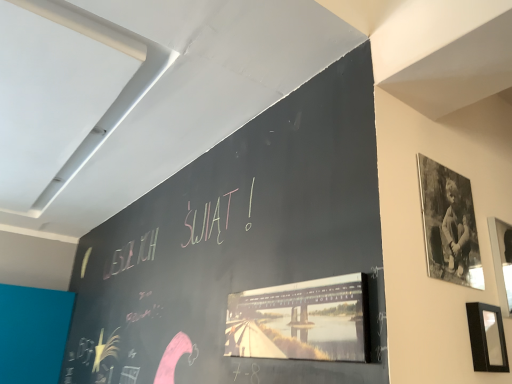
What is the approximate height of metallic photo frame at center?

8.23 inches.

Where is `metallic photo frame at center`? The height and width of the screenshot is (384, 512). metallic photo frame at center is located at coordinates (302, 320).

Measure the distance between metallic photo frame at center and camera.

metallic photo frame at center is 96.07 centimeters away from camera.

What do you see at coordinates (302, 320) in the screenshot? The width and height of the screenshot is (512, 384). I see `metallic photo frame at center` at bounding box center [302, 320].

Locate an element on the screen. Image resolution: width=512 pixels, height=384 pixels. metallic photo frame at center is located at coordinates (302, 320).